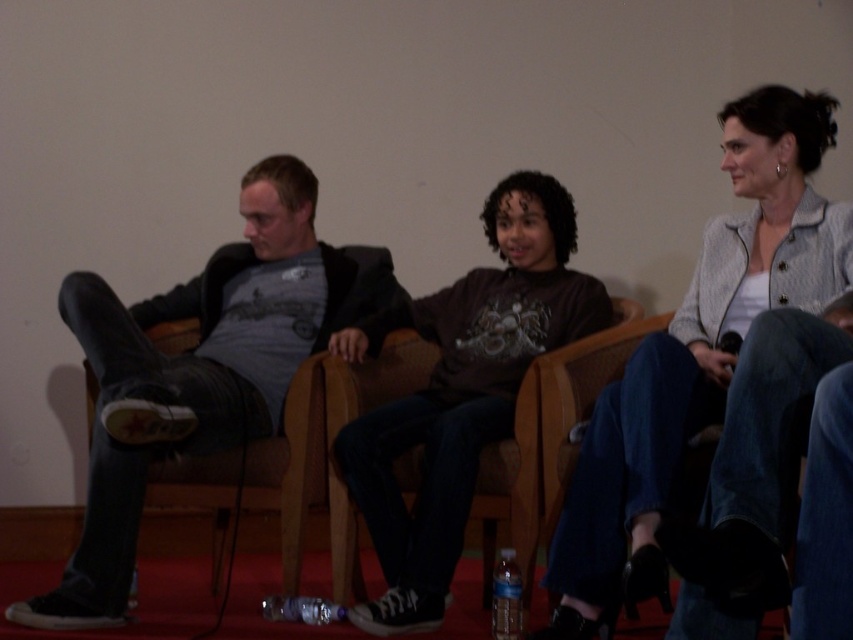
Based on the scene description, which object is smaller in size between the light gray textured blazer at upper right and the matte gray sweater at center?

The light gray textured blazer at upper right is smaller in size compared to the matte gray sweater at center according to the description.